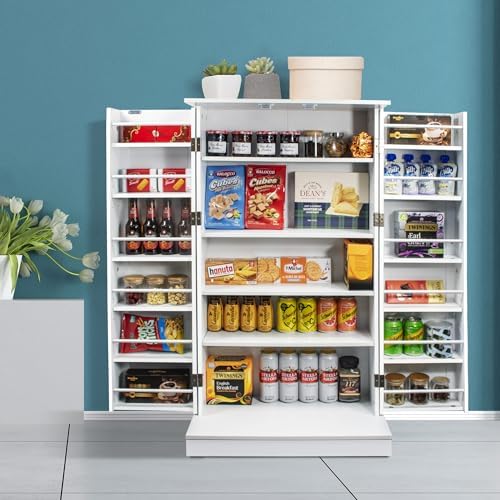
Locate an element on the screen. This screenshot has height=500, width=500. floor tiles is located at coordinates 49,432, 48,463, 50,496, 101,474, 107,428, 160,496, 423,466, 423,425, 460,497.